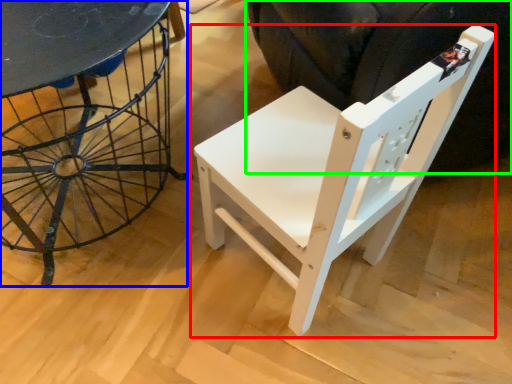
Question: Which object is the closest to the chair (highlighted by a red box)? Choose among these: table (highlighted by a blue box) or swivel chair (highlighted by a green box).

Choices:
 (A) table
 (B) swivel chair

Answer: (B)